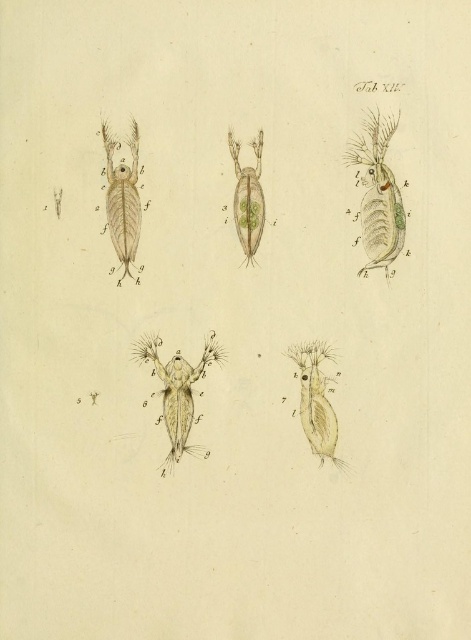
You are a researcher examining the image of microscopic organisms. You need to determine which organism takes up more space in the illustration. Which one is larger in size between the translucent green shrimp at upper right and the translucent beige crustacean at center?

The translucent beige crustacean at center occupies more space than the translucent green shrimp at upper right, so the translucent beige crustacean at center is larger in size.

You are a researcher studying the spatial arrangement of these microscopic organisms in the image. Based on their positions, which organism is closer to the viewer between the translucent green shrimp at upper right and the translucent beige crustacean at center?

The translucent green shrimp at upper right is closer to the viewer because it is positioned in front of the translucent beige crustacean at center.

You are a researcher examining this scientific illustration. You need to locate the translucent beige crustacean at lower right and the translucent beige crustacean at center. Which one appears closer to the viewer?

The translucent beige crustacean at center appears closer to the viewer because the one at lower right is positioned behind it.